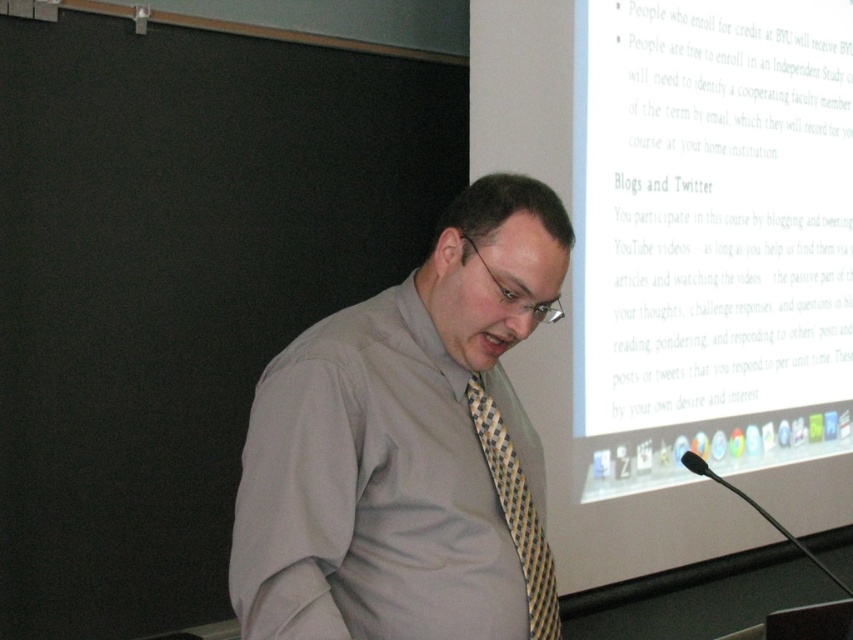
Between gray fabric shirt at center and yellow and black woven tie at center, which one appears on the left side from the viewer's perspective?

gray fabric shirt at center

Is gray fabric shirt at center in front of yellow and black woven tie at center?

Yes, it is.

Locate an element on the screen. The image size is (853, 640). gray fabric shirt at center is located at coordinates (408, 448).